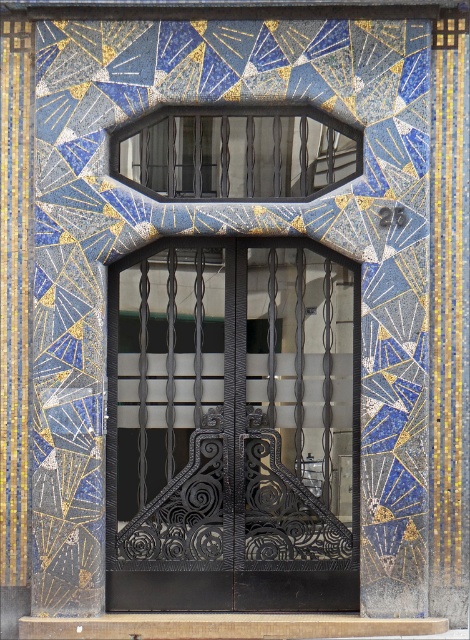
Question: Which of the following is the farthest from the observer?

Choices:
 (A) black wrought iron door at center
 (B) matte black glass at upper center

Answer: (B)

Question: Can you confirm if black wrought iron door at center is thinner than matte black glass at upper center?

Choices:
 (A) no
 (B) yes

Answer: (A)

Question: Does black wrought iron door at center lie in front of matte black glass at upper center?

Choices:
 (A) no
 (B) yes

Answer: (B)

Question: Which point is farther from the camera taking this photo?

Choices:
 (A) (297, 164)
 (B) (334, 534)

Answer: (A)

Question: Which object is farther from the camera taking this photo?

Choices:
 (A) matte black glass at upper center
 (B) black wrought iron door at center

Answer: (A)

Question: Can you confirm if black wrought iron door at center is bigger than matte black glass at upper center?

Choices:
 (A) yes
 (B) no

Answer: (A)